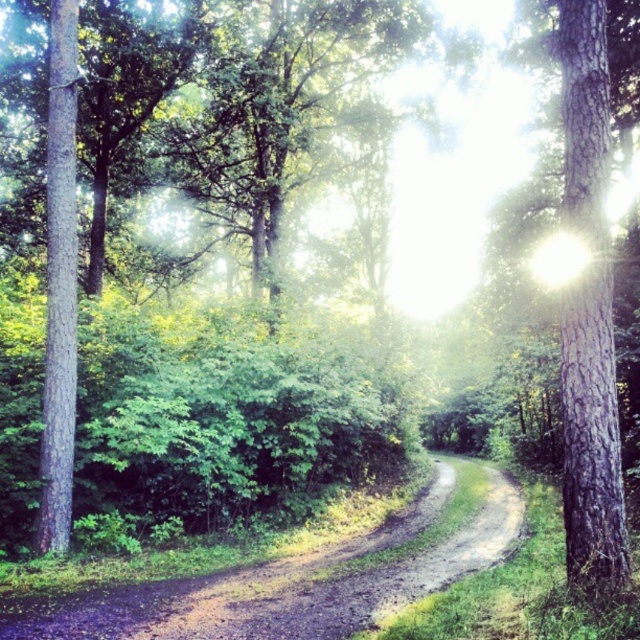
Does dusty brown dirt track at center appear on the right side of smooth bark tree at right?

→ In fact, dusty brown dirt track at center is to the left of smooth bark tree at right.

Describe the element at coordinates (291, 582) in the screenshot. I see `dusty brown dirt track at center` at that location.

Does point (396, 608) come closer to viewer compared to point (576, 541)?

No, (396, 608) is behind (576, 541).

Where is `dusty brown dirt track at center`? The width and height of the screenshot is (640, 640). dusty brown dirt track at center is located at coordinates (291, 582).